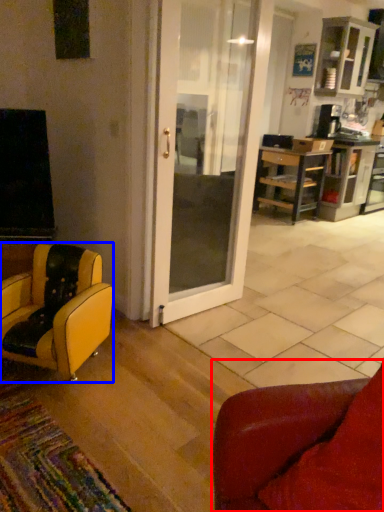
Question: Which point is closer to the camera, chair (highlighted by a red box) or chair (highlighted by a blue box)?

Choices:
 (A) chair
 (B) chair

Answer: (A)